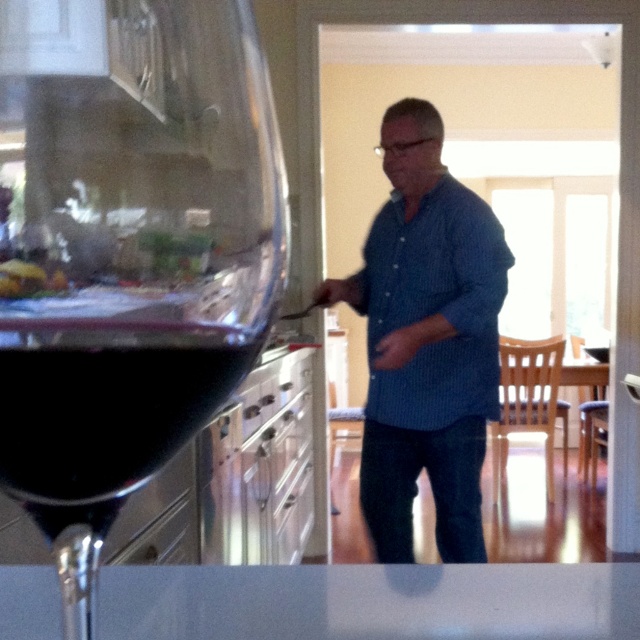
You are a guest in this kitchen and want to pour the dark red liquid at left into the blue striped shirt at center. Is this possible given their positions?

The blue striped shirt at center is below the dark red liquid at left, so pouring the dark red liquid at left into the blue striped shirt at center would be possible as it is positioned above the shirt.

You are a photographer trying to capture the perfect shot of the kitchen scene. You notice two points in the image at coordinates point (148, 474) and point (266, 332). Which point is closer to the camera?

Point (148, 474) is closer to the camera than point (266, 332).